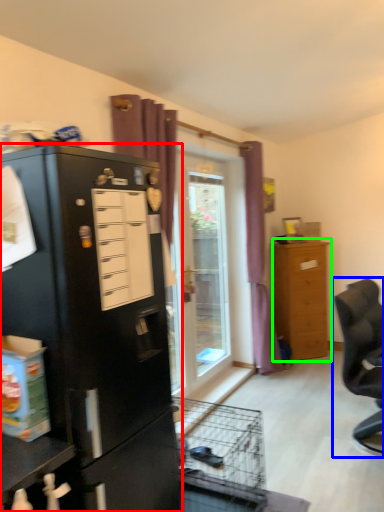
Question: Which is nearer to the cupboard (highlighted by a red box)? chair (highlighted by a blue box) or chest of drawers (highlighted by a green box).

Choices:
 (A) chair
 (B) chest of drawers

Answer: (A)